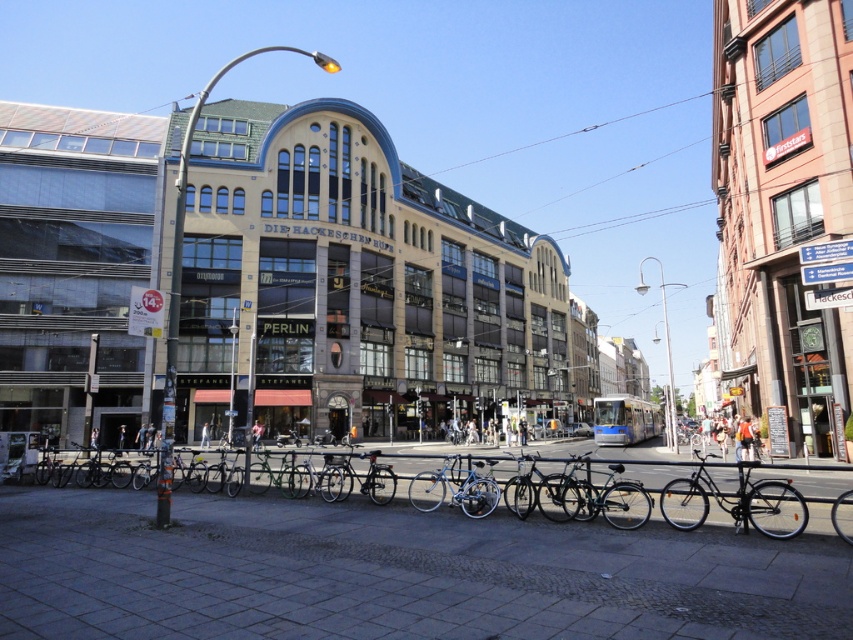
Question: Which point appears closest to the camera in this image?

Choices:
 (A) (706, 509)
 (B) (527, 467)
 (C) (750, 428)
 (D) (117, 448)

Answer: (A)

Question: Estimate the real-world distances between objects in this image. Which object is farther from the shiny blue bicycle at center?

Choices:
 (A) dark blue jeans at lower left
 (B) orange fabric backpack at center

Answer: (A)

Question: Where is orange fabric backpack at center located in relation to dark blue jeans at center in the image?

Choices:
 (A) right
 (B) left

Answer: (A)

Question: Does shiny black bicycle at lower left have a smaller size compared to shiny black bike at lower right?

Choices:
 (A) yes
 (B) no

Answer: (B)

Question: Which object is the closest to the orange fabric backpack at center?

Choices:
 (A) shiny black bike at lower right
 (B) shiny blue bicycle at center

Answer: (A)

Question: Can you confirm if white cotton shirt at center is positioned below dark blue jeans at center?

Choices:
 (A) yes
 (B) no

Answer: (B)